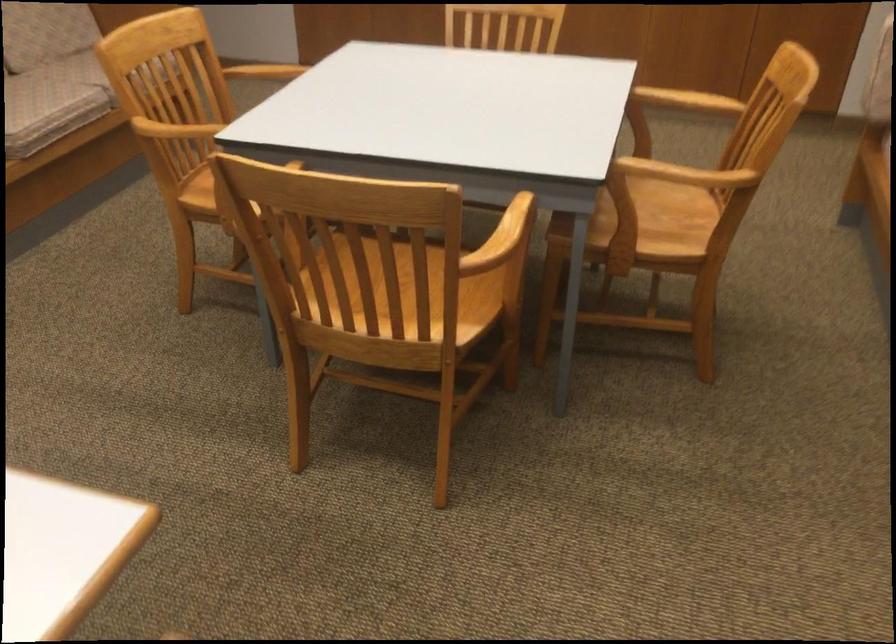
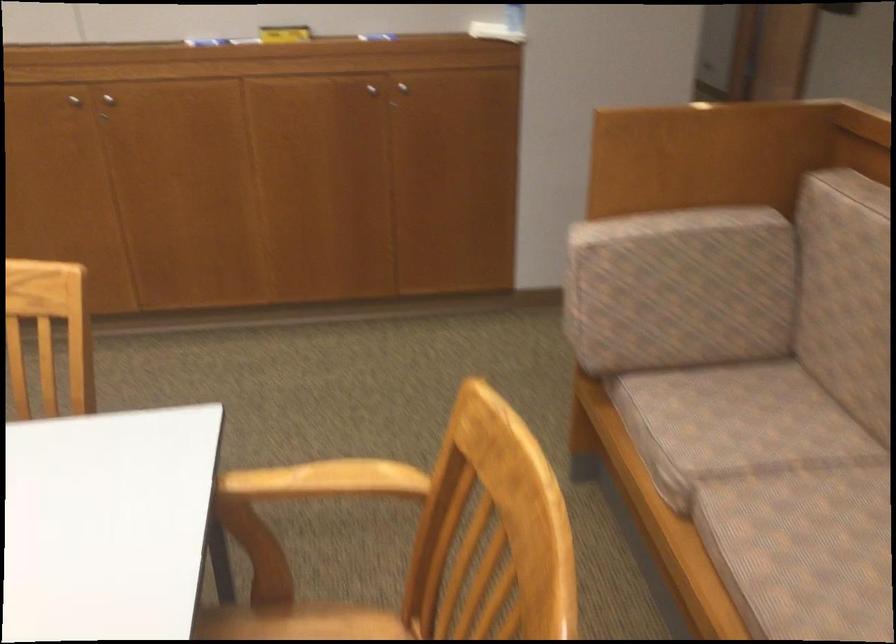
Which direction would the cameraman need to move to produce the second image?

The movement direction of the cameraman is right, forward.